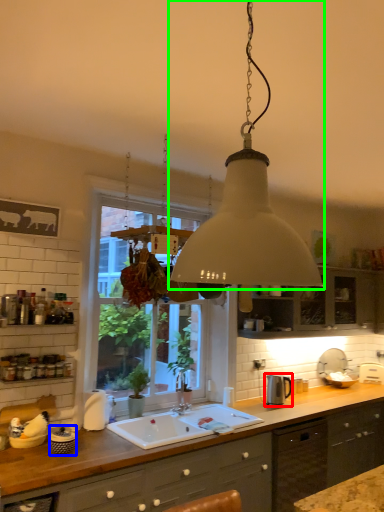
Question: Which is farther away from appliance (highlighted by a red box)? appliance (highlighted by a blue box) or lamp (highlighted by a green box)?

Choices:
 (A) appliance
 (B) lamp

Answer: (B)